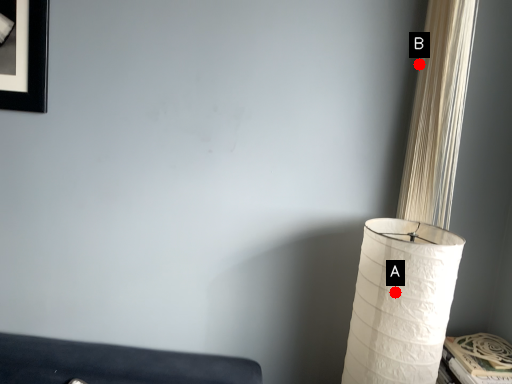
Question: Two points are circled on the image, labeled by A and B beside each circle. Which point appears farthest from the camera in this image?

Choices:
 (A) A is further
 (B) B is further

Answer: (B)